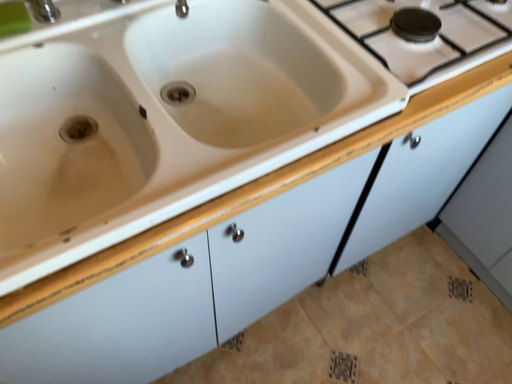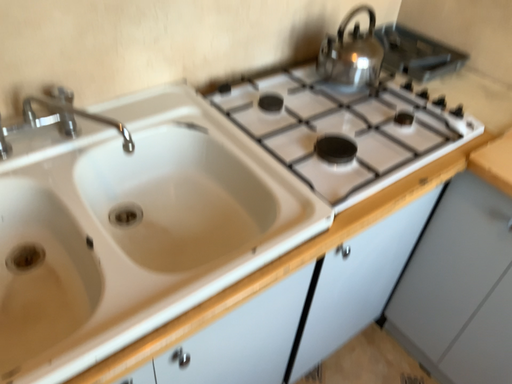
Question: Which way did the camera rotate in the video?

Choices:
 (A) rotated upward
 (B) rotated downward

Answer: (A)